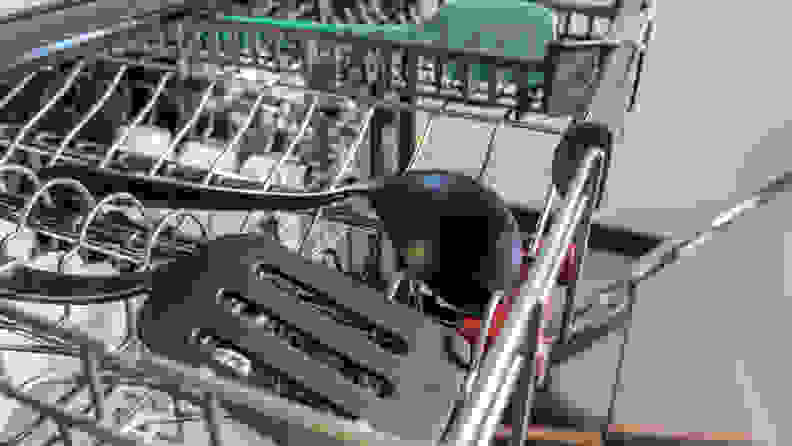
Locate an element on the screen. The image size is (792, 446). black ladle is located at coordinates (477, 220).